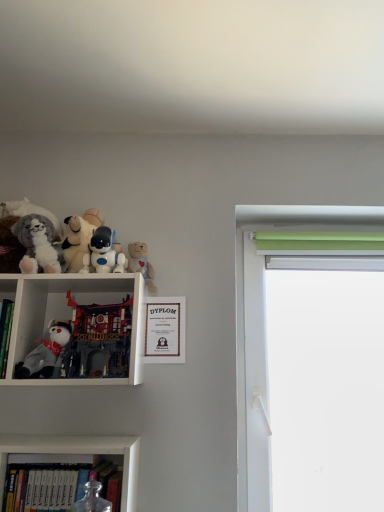
Question: Can you confirm if white plush toy at left, which is the fifth toy from right to left, is bigger than matte gold picture frame at center?

Choices:
 (A) yes
 (B) no

Answer: (A)

Question: Is matte gold picture frame at center at the back of white plush toy at left, which is the fifth toy from right to left?

Choices:
 (A) no
 (B) yes

Answer: (A)

Question: Is white plush toy at left, the second toy positioned from the left, to the left of matte gold picture frame at center from the viewer's perspective?

Choices:
 (A) no
 (B) yes

Answer: (B)

Question: Is white plush toy at left, which is the fifth toy from right to left, taller than matte gold picture frame at center?

Choices:
 (A) yes
 (B) no

Answer: (B)

Question: Does white plush toy at left, the second toy positioned from the left, have a lesser width compared to matte gold picture frame at center?

Choices:
 (A) yes
 (B) no

Answer: (B)

Question: Is white plush toy at left, which is the fifth toy from right to left, taller or shorter than hardcover books at lower left, the 2th bookcase in the top-to-bottom sequence?

Choices:
 (A) short
 (B) tall

Answer: (A)

Question: Would you say white plush toy at left, the second toy positioned from the left, is to the left or to the right of hardcover books at lower left, placed as the first bookcase when sorted from bottom to top, in the picture?

Choices:
 (A) right
 (B) left

Answer: (B)

Question: Is white plush toy at left, the second toy positioned from the left, wider or thinner than hardcover books at lower left, placed as the first bookcase when sorted from bottom to top?

Choices:
 (A) thin
 (B) wide

Answer: (A)

Question: From the image's perspective, is white plush toy at left, which is the fifth toy from right to left, located above or below hardcover books at lower left, placed as the first bookcase when sorted from bottom to top?

Choices:
 (A) below
 (B) above

Answer: (B)

Question: Is point (140, 294) positioned closer to the camera than point (26, 247)?

Choices:
 (A) farther
 (B) closer

Answer: (A)

Question: In terms of size, does white matte bookcase at left, the 2th bookcase when ordered from bottom to top, appear bigger or smaller than fluffy plush cat at left, the sixth toy in the right-to-left sequence?

Choices:
 (A) small
 (B) big

Answer: (B)

Question: In the image, is white matte bookcase at left, the 2th bookcase when ordered from bottom to top, on the left side or the right side of fluffy plush cat at left, which appears as the 1th toy when viewed from the left?

Choices:
 (A) right
 (B) left

Answer: (A)

Question: Relative to fluffy plush cat at left, which appears as the 1th toy when viewed from the left, is white matte bookcase at left, the 2th bookcase when ordered from bottom to top, in front or behind?

Choices:
 (A) front
 (B) behind

Answer: (A)

Question: Is white plush bear at upper center, positioned as the sixth toy in left-to-right order, situated inside matte gold picture frame at center or outside?

Choices:
 (A) outside
 (B) inside

Answer: (A)

Question: Considering the positions of white plush bear at upper center, positioned as the sixth toy in left-to-right order, and matte gold picture frame at center in the image, is white plush bear at upper center, positioned as the sixth toy in left-to-right order, taller or shorter than matte gold picture frame at center?

Choices:
 (A) tall
 (B) short

Answer: (B)